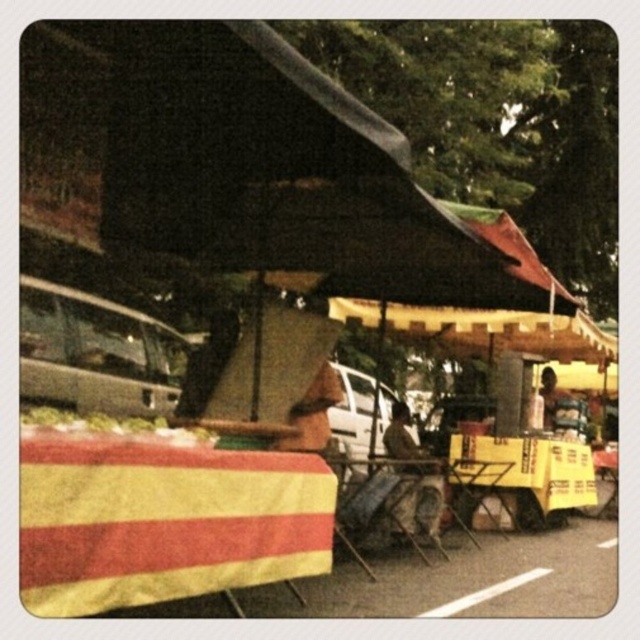
You are standing at the food stall with a bright yellow canopy and want to walk to the striped tablecloth in the foreground. Which point, point (109, 593) or point (545, 474), is closer to your starting position?

Point (109, 593) is closer to your starting position at the food stall with a bright yellow canopy because it is in front of point (545, 474).

You are a customer at the food stall under the yellow canopy. You notice two items in the scene. One is the yellow paper sign at lower right and the other is the brown leather jacket at upper right. Which of these two items is larger in size?

The yellow paper sign at lower right is bigger than the brown leather jacket at upper right, so the yellow paper sign at lower right is larger in size.